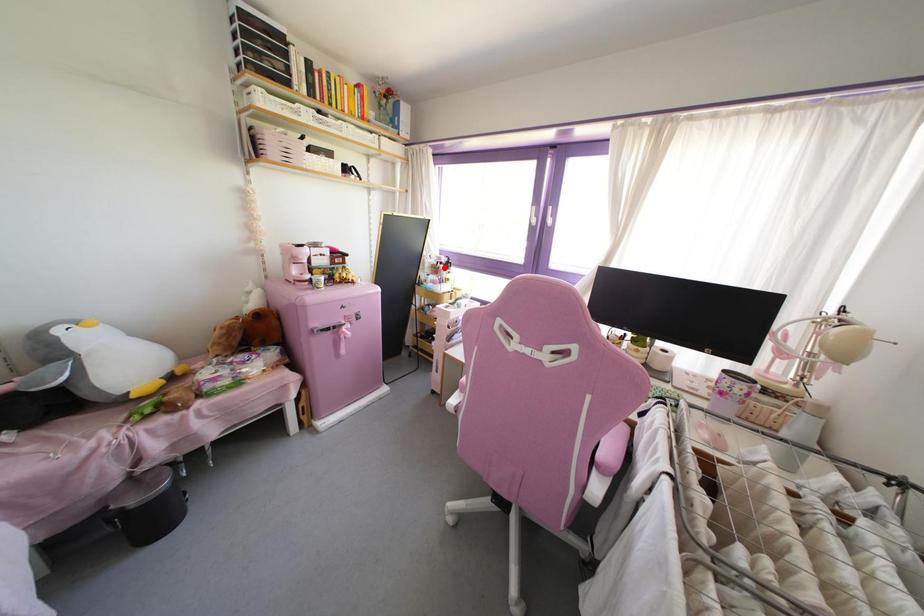
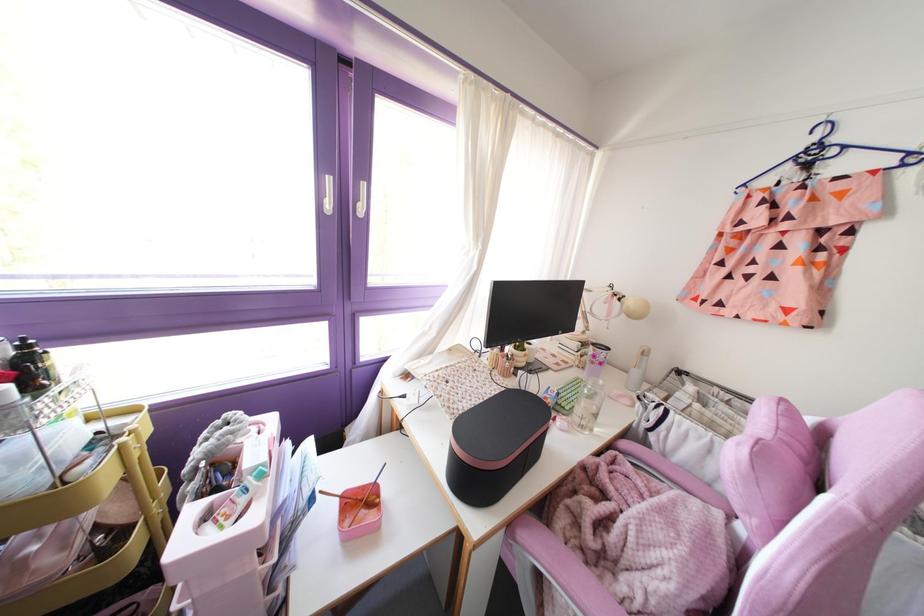
In the second image, find the point that corresponds to the highlighted location in the first image.

(32, 389)